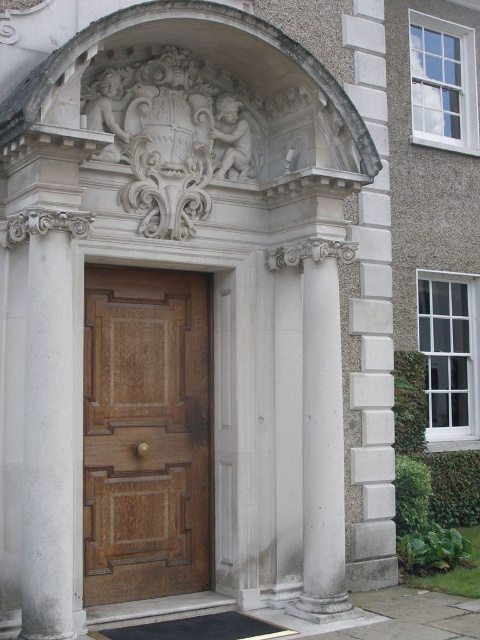
In the scene shown: You are standing in front of the grand entrance of the historic building. You need to locate the wooden door at center. Based on its coordinates, where exactly should you look to find it?

The wooden door at center is located at coordinates point 0.680 on the x axis and 0.304 on the y axis.

You are standing at the entrance of the historic building and want to enter through the wooden door at center. To do so, you need to pass between the white stone column at right and another column on the left. Is there enough space between the columns to walk through comfortably?

The wooden door at center is above the white stone column at right, but the distance between the columns isn